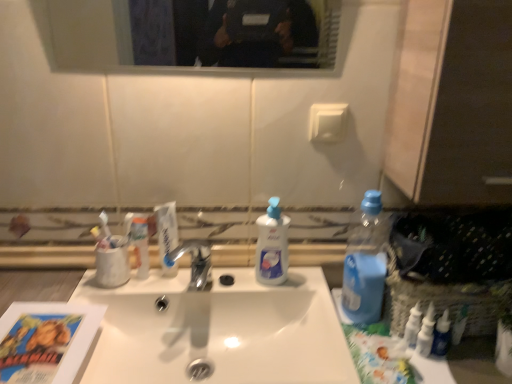
The height and width of the screenshot is (384, 512). Find the location of `unoccupied area in front of white glossy toothpaste at center`. unoccupied area in front of white glossy toothpaste at center is located at coordinates (146, 303).